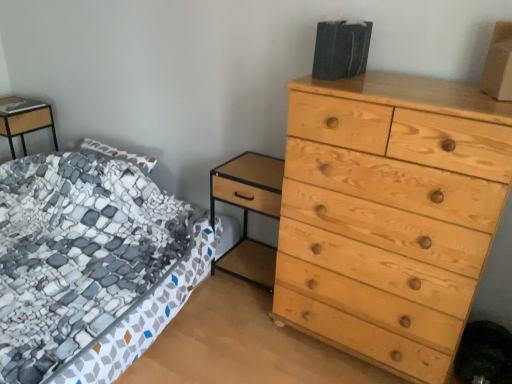
What is the approximate height of patterned fabric bed at left?

patterned fabric bed at left is 51.62 centimeters tall.

This screenshot has width=512, height=384. What do you see at coordinates (499, 64) in the screenshot? I see `brown cardboard box at upper right` at bounding box center [499, 64].

Based on the photo, measure the distance between light wood/texture nightstand at center, the second nightstand from the top, and camera.

1.83 meters.

What is the approximate height of light wood chest of drawers at right?

light wood chest of drawers at right is 3.76 feet tall.

Locate an element on the screen. This screenshot has width=512, height=384. light wood chest of drawers at right is located at coordinates (389, 215).

Find the location of a particular element. This screenshot has width=512, height=384. matte wood nightstand at left, arranged as the 1th nightstand when viewed from the top is located at coordinates (26, 124).

Does point (14, 113) come closer to viewer compared to point (189, 278)?

No, (14, 113) is further to viewer.

Considering the relative sizes of matte wood nightstand at left, arranged as the 1th nightstand when viewed from the top, and patterned fabric bed at left in the image provided, is matte wood nightstand at left, arranged as the 1th nightstand when viewed from the top, smaller than patterned fabric bed at left?

Indeed, matte wood nightstand at left, arranged as the 1th nightstand when viewed from the top, has a smaller size compared to patterned fabric bed at left.

From a real-world perspective, relative to patterned fabric bed at left, is matte wood nightstand at left, the 2th nightstand positioned from the bottom, vertically above or below?

matte wood nightstand at left, the 2th nightstand positioned from the bottom, is above patterned fabric bed at left.

Is matte wood nightstand at left, arranged as the 1th nightstand when viewed from the top, to the left or to the right of patterned fabric bed at left in the image?

In the image, matte wood nightstand at left, arranged as the 1th nightstand when viewed from the top, appears on the left side of patterned fabric bed at left.

Could you tell me if light wood chest of drawers at right is facing matte wood nightstand at left, arranged as the 2th nightstand when viewed from the front?

No, light wood chest of drawers at right is not turned towards matte wood nightstand at left, arranged as the 2th nightstand when viewed from the front.

In terms of width, does light wood chest of drawers at right look wider or thinner when compared to matte wood nightstand at left, arranged as the 2th nightstand when viewed from the front?

light wood chest of drawers at right is wider than matte wood nightstand at left, arranged as the 2th nightstand when viewed from the front.

How different are the orientations of light wood chest of drawers at right and matte wood nightstand at left, arranged as the 2th nightstand when viewed from the front, in degrees?

The facing directions of light wood chest of drawers at right and matte wood nightstand at left, arranged as the 2th nightstand when viewed from the front, are 2 degrees apart.

Which of these two, light wood chest of drawers at right or patterned fabric bed at left, stands taller?

light wood chest of drawers at right.

From a real-world perspective, which object rests below the other?

patterned fabric bed at left, from a real-world perspective.

Is light wood chest of drawers at right further to the viewer compared to patterned fabric bed at left?

Yes, it is.

Is light wood chest of drawers at right oriented away from patterned fabric bed at left?

No, patterned fabric bed at left is not at the back of light wood chest of drawers at right.

Consider the image. Which object is positioned more to the left, matte wood nightstand at left, arranged as the 2th nightstand when viewed from the front, or brown cardboard box at upper right?

From the viewer's perspective, matte wood nightstand at left, arranged as the 2th nightstand when viewed from the front, appears more on the left side.

Would you say brown cardboard box at upper right is part of matte wood nightstand at left, arranged as the 1th nightstand when viewed from the back,'s contents?

Actually, brown cardboard box at upper right is outside matte wood nightstand at left, arranged as the 1th nightstand when viewed from the back.

From a real-world perspective, who is located lower, matte wood nightstand at left, the 2th nightstand positioned from the bottom, or brown cardboard box at upper right?

In real-world perspective, matte wood nightstand at left, the 2th nightstand positioned from the bottom, is lower.

Are matte wood nightstand at left, arranged as the 2th nightstand when viewed from the front, and brown cardboard box at upper right far apart?

Yes, matte wood nightstand at left, arranged as the 2th nightstand when viewed from the front, is far from brown cardboard box at upper right.

From the image's perspective, which object appears higher, patterned fabric bed at left or light wood/texture nightstand at center, the 1th nightstand viewed from the right?

light wood/texture nightstand at center, the 1th nightstand viewed from the right, from the image's perspective.

Is patterned fabric bed at left facing towards light wood/texture nightstand at center, positioned as the first nightstand in bottom-to-top order?

No, patterned fabric bed at left is not facing towards light wood/texture nightstand at center, positioned as the first nightstand in bottom-to-top order.

Does patterned fabric bed at left have a smaller size compared to light wood/texture nightstand at center, the 1th nightstand viewed from the right?

No.

Is patterned fabric bed at left surrounding light wood/texture nightstand at center, the 2th nightstand viewed from the back?

Absolutely, light wood/texture nightstand at center, the 2th nightstand viewed from the back, is inside patterned fabric bed at left.

Which object is positioned more to the left, light wood/texture nightstand at center, the 1th nightstand viewed from the right, or brown cardboard box at upper right?

Positioned to the left is light wood/texture nightstand at center, the 1th nightstand viewed from the right.

Is light wood/texture nightstand at center, the second nightstand from the top, positioned with its back to brown cardboard box at upper right?

No, light wood/texture nightstand at center, the second nightstand from the top, is not facing the opposite direction of brown cardboard box at upper right.

Does light wood/texture nightstand at center, which appears as the first nightstand when viewed from the front, have a greater width compared to brown cardboard box at upper right?

Indeed, light wood/texture nightstand at center, which appears as the first nightstand when viewed from the front, has a greater width compared to brown cardboard box at upper right.

Consider the image. Which object is further away from the camera taking this photo, light wood/texture nightstand at center, which appears as the first nightstand when viewed from the front, or brown cardboard box at upper right?

light wood/texture nightstand at center, which appears as the first nightstand when viewed from the front.

Can you see brown cardboard box at upper right touching light wood/texture nightstand at center, the 1th nightstand viewed from the right?

brown cardboard box at upper right and light wood/texture nightstand at center, the 1th nightstand viewed from the right, are clearly separated.

From the image's perspective, which one is positioned higher, brown cardboard box at upper right or light wood/texture nightstand at center, the second nightstand from the top?

brown cardboard box at upper right appears higher in the image.

Locate an element on the screen. cardboard box above the light wood/texture nightstand at center, the second nightstand from the top (from a real-world perspective) is located at coordinates (499, 64).

Is point (508, 40) farther from viewer compared to point (256, 173)?

No, it is in front of (256, 173).

Find the location of a particular element. nightstand that is the 2nd one above the patterned fabric bed at left (from a real-world perspective) is located at coordinates (26, 124).

Which nightstand is the 2nd one when counting from the back of the light wood chest of drawers at right? Please provide its 2D coordinates.

[(26, 124)]

Which object lies nearer to the anchor point matte wood nightstand at left, the 2th nightstand positioned from the bottom, patterned fabric bed at left or brown cardboard box at upper right?

Among the two, patterned fabric bed at left is located nearer to matte wood nightstand at left, the 2th nightstand positioned from the bottom.

Based on their spatial positions, is light wood/texture nightstand at center, positioned as the first nightstand in bottom-to-top order, or light wood chest of drawers at right further from matte wood nightstand at left, which is the 1th nightstand from left to right?

light wood chest of drawers at right is further to matte wood nightstand at left, which is the 1th nightstand from left to right.

From the picture: Looking at the image, which one is located closer to light wood chest of drawers at right, matte wood nightstand at left, arranged as the 2th nightstand when viewed from the front, or brown cardboard box at upper right?

brown cardboard box at upper right lies closer to light wood chest of drawers at right than the other object.

Which object lies further to the anchor point light wood/texture nightstand at center, positioned as the first nightstand in bottom-to-top order, patterned fabric bed at left or matte wood nightstand at left, arranged as the 2th nightstand when viewed from the front?

matte wood nightstand at left, arranged as the 2th nightstand when viewed from the front, lies further to light wood/texture nightstand at center, positioned as the first nightstand in bottom-to-top order, than the other object.

Based on their spatial positions, is light wood chest of drawers at right or brown cardboard box at upper right further from matte wood nightstand at left, which is the 1th nightstand from left to right?

brown cardboard box at upper right lies further to matte wood nightstand at left, which is the 1th nightstand from left to right, than the other object.

When comparing their distances from patterned fabric bed at left, does brown cardboard box at upper right or light wood chest of drawers at right seem closer?

light wood chest of drawers at right.

Which object lies further to the anchor point light wood/texture nightstand at center, the 2th nightstand viewed from the back, matte wood nightstand at left, the second nightstand viewed from the right, or light wood chest of drawers at right?

matte wood nightstand at left, the second nightstand viewed from the right, is positioned further to the anchor light wood/texture nightstand at center, the 2th nightstand viewed from the back.

Consider the image. Which object lies nearer to the anchor point brown cardboard box at upper right, patterned fabric bed at left or light wood chest of drawers at right?

Based on the image, light wood chest of drawers at right appears to be nearer to brown cardboard box at upper right.

At what (x,y) coordinates should I click in order to perform the action: click on bed situated between matte wood nightstand at left, arranged as the 1th nightstand when viewed from the top, and light wood/texture nightstand at center, the second nightstand when ordered from left to right, from left to right. Please return your answer as a coordinate pair (x, y). The image size is (512, 384). Looking at the image, I should click on (89, 265).

This screenshot has height=384, width=512. In order to click on nightstand between patterned fabric bed at left and light wood chest of drawers at right from left to right in this screenshot , I will do `click(248, 212)`.

Locate an element on the screen. The height and width of the screenshot is (384, 512). chest of drawers between patterned fabric bed at left and brown cardboard box at upper right from left to right is located at coordinates (389, 215).

Image resolution: width=512 pixels, height=384 pixels. Identify the location of bed located between matte wood nightstand at left, arranged as the 2th nightstand when viewed from the front, and brown cardboard box at upper right in the left-right direction. (89, 265).